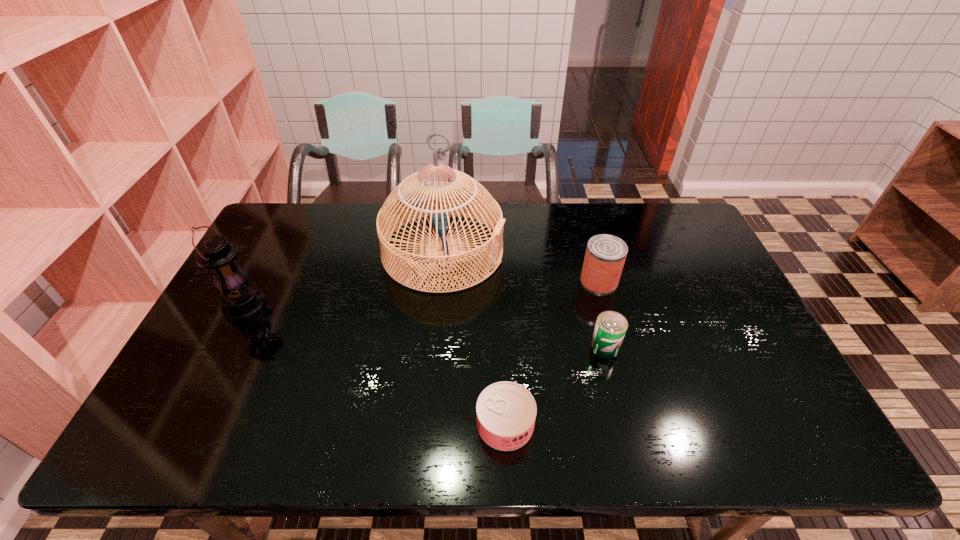
Where is `vacant space at the far left corner`? vacant space at the far left corner is located at coordinates (301, 243).

Image resolution: width=960 pixels, height=540 pixels. In the image, there is a desktop. Find the location of `free region at the far right corner`. free region at the far right corner is located at coordinates 688,225.

In order to click on free point between the leftmost object and the tallest object in this screenshot , I will do `click(345, 278)`.

The height and width of the screenshot is (540, 960). In order to click on free area in between the nearest can and the second shortest can in this screenshot , I will do `click(555, 386)`.

At what (x,y) coordinates should I click in order to perform the action: click on vacant space that's between the second farthest can and the nearest object. Please return your answer as a coordinate pair (x, y). Image resolution: width=960 pixels, height=540 pixels. Looking at the image, I should click on (555, 386).

Identify the location of vacant area between the birdcage and the leftmost can. (474, 338).

Find the location of a particular element. vacant area that lies between the farthest can and the fourth shortest object is located at coordinates (422, 293).

Where is `vacant region between the third shortest object and the shortest can`? vacant region between the third shortest object and the shortest can is located at coordinates (552, 353).

In order to click on free space between the leftmost object and the second shortest object in this screenshot , I will do `click(425, 326)`.

The image size is (960, 540). Identify the location of unoccupied position between the second tallest can and the nearest can. (555, 386).